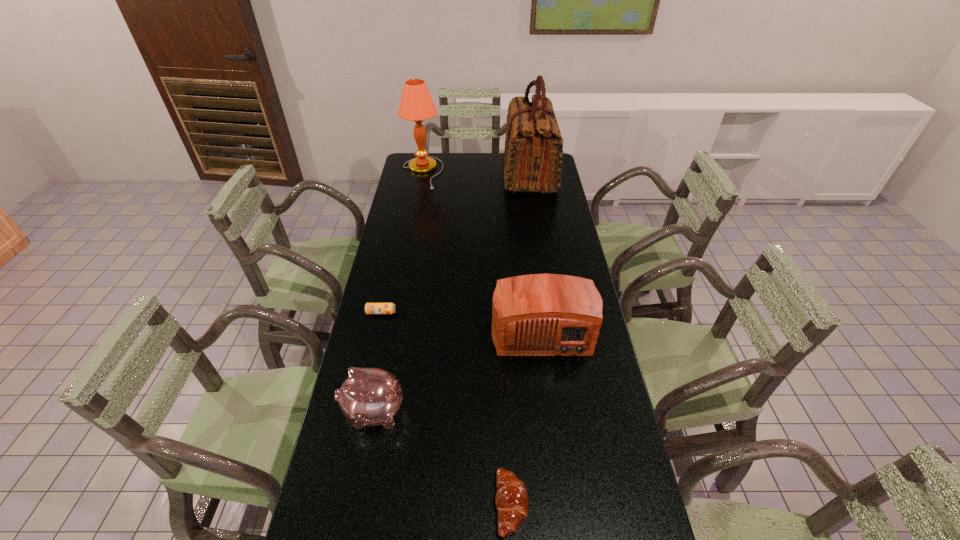
Locate an element on the screen. The height and width of the screenshot is (540, 960). object that ranks as the fifth closest to the beer can is located at coordinates (533, 149).

Locate an element on the screen. This screenshot has width=960, height=540. free space that satisfies the following two spatial constraints: 1. on the open handle side of the shopping bag; 2. on the front-facing side of the radio receiver is located at coordinates (555, 328).

The image size is (960, 540). I want to click on free space that satisfies the following two spatial constraints: 1. on the open handle side of the shopping bag; 2. on the front-facing side of the radio receiver, so coord(555,328).

Find the location of `free space that satisfies the following two spatial constraints: 1. on the open handle side of the shopping bag; 2. on the front side of the shortest object`. free space that satisfies the following two spatial constraints: 1. on the open handle side of the shopping bag; 2. on the front side of the shortest object is located at coordinates (553, 313).

In order to click on vacant point that satisfies the following two spatial constraints: 1. on the back side of the lamp; 2. on the left side of the beer can in this screenshot , I will do `click(412, 173)`.

Find the location of a particular element. free space that satisfies the following two spatial constraints: 1. on the back side of the lamp; 2. on the right side of the shortest object is located at coordinates (412, 173).

You are a GUI agent. You are given a task and a screenshot of the screen. Output one action in this format:
    pyautogui.click(x=<x>, y=<y>)
    Task: Click on the free location that satisfies the following two spatial constraints: 1. on the open handle side of the shopping bag; 2. on the front side of the shortest object
    
    Given the screenshot: What is the action you would take?
    pyautogui.click(x=553, y=313)